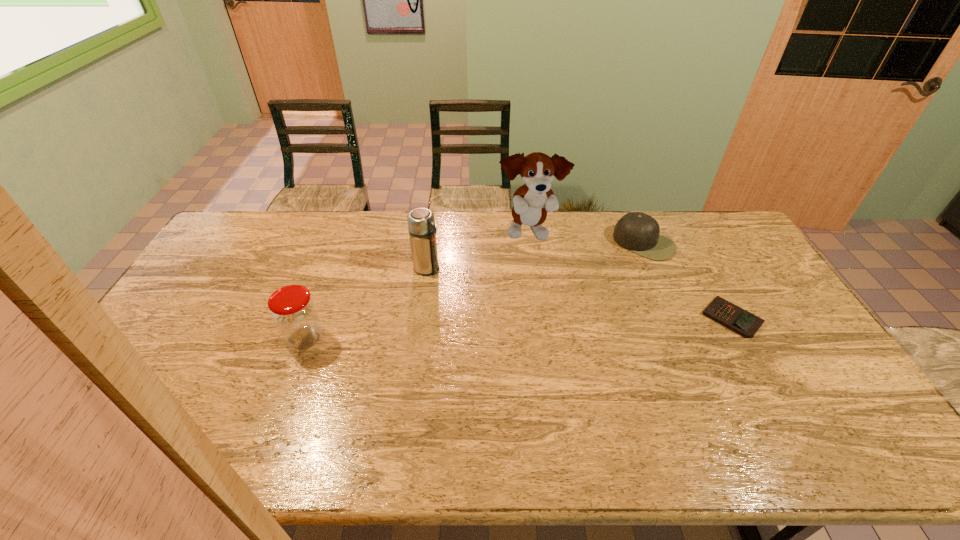
Where is `puppy located at the far edge`? This screenshot has width=960, height=540. puppy located at the far edge is located at coordinates (532, 201).

Where is `object present at the right edge`? This screenshot has width=960, height=540. object present at the right edge is located at coordinates (733, 317).

The width and height of the screenshot is (960, 540). I want to click on vacant space at the far edge of the desktop, so click(516, 240).

In the image, there is a desktop. Where is `vacant space at the near edge`? Image resolution: width=960 pixels, height=540 pixels. vacant space at the near edge is located at coordinates (413, 408).

Locate an element on the screen. The height and width of the screenshot is (540, 960). blank space at the left edge of the desktop is located at coordinates (229, 276).

In the image, there is a desktop. Where is `blank space at the right edge`? blank space at the right edge is located at coordinates (721, 278).

Identify the location of free spot at the far right corner of the desktop. The height and width of the screenshot is (540, 960). (708, 218).

The image size is (960, 540). In the image, there is a desktop. Identify the location of vacant area at the near right corner. point(793,388).

Find the location of a particular element. The height and width of the screenshot is (540, 960). vacant area between the calculator and the cap is located at coordinates (688, 281).

In order to click on free space between the puppy and the calculator in this screenshot , I will do `click(631, 275)`.